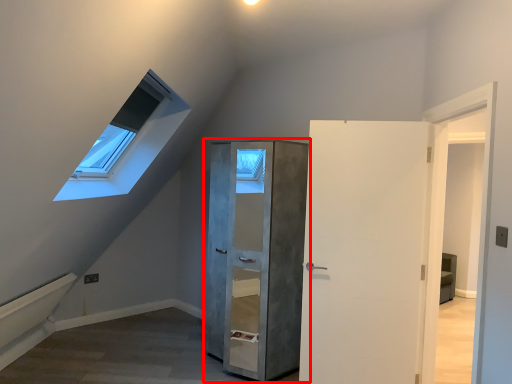
Question: From the image's perspective, what is the correct spatial positioning of cupboard (annotated by the red box) in reference to door?

Choices:
 (A) below
 (B) above

Answer: (A)